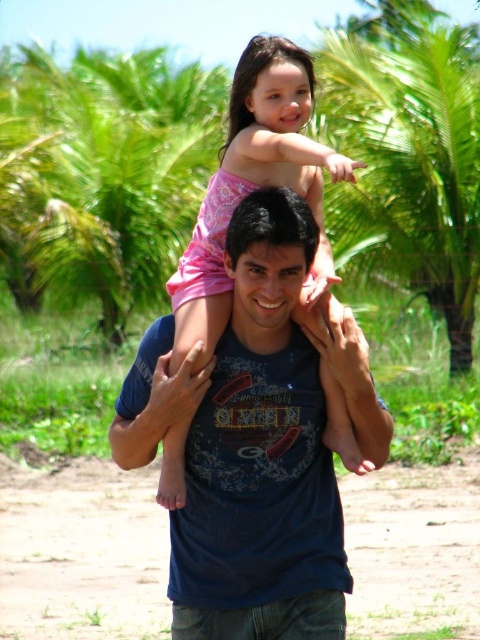
Which is more to the left, brown dirt track at center or pink cotton shirt at center?

brown dirt track at center

Is brown dirt track at center to the right of pink cotton shirt at center from the viewer's perspective?

In fact, brown dirt track at center is to the left of pink cotton shirt at center.

What do you see at coordinates (82, 552) in the screenshot?
I see `brown dirt track at center` at bounding box center [82, 552].

The width and height of the screenshot is (480, 640). I want to click on brown dirt track at center, so click(x=82, y=552).

Between point (129, 636) and point (462, 273), which one is positioned behind?

Point (462, 273)

Does brown dirt track at center have a lesser width compared to green leafy palm tree at upper center?

Correct, brown dirt track at center's width is less than green leafy palm tree at upper center's.

The height and width of the screenshot is (640, 480). Identify the location of brown dirt track at center. (82, 552).

In the scene shown: Can you confirm if green leafy palm tree at upper left is thinner than green leafy palm tree at upper center?

No, green leafy palm tree at upper left is not thinner than green leafy palm tree at upper center.

Which is in front, point (120, 332) or point (384, 179)?

Point (384, 179) is in front.

Where is `green leafy palm tree at upper left`? green leafy palm tree at upper left is located at coordinates (104, 173).